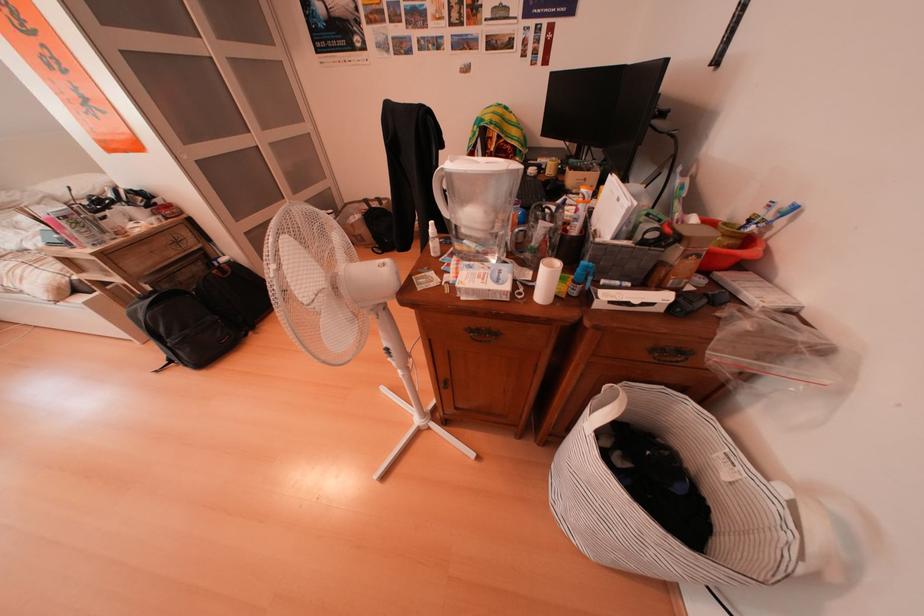
The image size is (924, 616). In order to click on wardrobe door groove in this screenshot , I will do (260, 185).